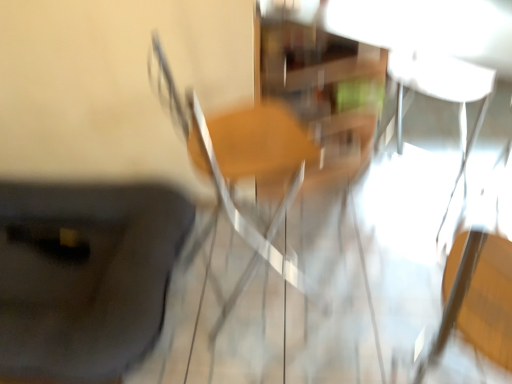
The image size is (512, 384). What do you see at coordinates (212, 177) in the screenshot?
I see `wooden chair at center` at bounding box center [212, 177].

This screenshot has width=512, height=384. I want to click on wooden chair at center, so click(x=212, y=177).

The height and width of the screenshot is (384, 512). Find the location of `black matte suitcase at lower left`. black matte suitcase at lower left is located at coordinates pos(85,276).

What do you see at coordinates (85, 276) in the screenshot? I see `black matte suitcase at lower left` at bounding box center [85, 276].

Image resolution: width=512 pixels, height=384 pixels. In order to click on wooden chair at center in this screenshot , I will do `click(212, 177)`.

Considering the relative positions of black matte suitcase at lower left and wooden chair at center in the image provided, is black matte suitcase at lower left to the left of wooden chair at center from the viewer's perspective?

Yes.

Considering their positions, is black matte suitcase at lower left located in front of or behind wooden chair at center?

Visually, black matte suitcase at lower left is located behind wooden chair at center.

Does point (143, 332) appear closer or farther from the camera than point (267, 243)?

Point (143, 332) is closer to the camera than point (267, 243).

From the image's perspective, is black matte suitcase at lower left above or below wooden chair at center?

black matte suitcase at lower left is situated lower than wooden chair at center in the image.

From a real-world perspective, is black matte suitcase at lower left below wooden chair at center?

Yes.

Considering the sizes of objects black matte suitcase at lower left and wooden chair at center in the image provided, who is wider, black matte suitcase at lower left or wooden chair at center?

black matte suitcase at lower left.

Considering the sizes of black matte suitcase at lower left and wooden chair at center in the image, is black matte suitcase at lower left taller or shorter than wooden chair at center?

Clearly, black matte suitcase at lower left is shorter compared to wooden chair at center.

Is black matte suitcase at lower left bigger or smaller than wooden chair at center?

black matte suitcase at lower left is bigger than wooden chair at center.

Choose the correct answer: Is black matte suitcase at lower left inside wooden chair at center or outside it?

black matte suitcase at lower left exists outside the volume of wooden chair at center.

Is black matte suitcase at lower left not close to wooden chair at center?

They are positioned close to each other.

Could you tell me if black matte suitcase at lower left is turned towards wooden chair at center?

No.

The width and height of the screenshot is (512, 384). I want to click on chair on the right of black matte suitcase at lower left, so click(x=212, y=177).

Can you confirm if wooden chair at center is positioned to the left of black matte suitcase at lower left?

In fact, wooden chair at center is to the right of black matte suitcase at lower left.

Which object is closer to the camera taking this photo, wooden chair at center or black matte suitcase at lower left?

wooden chair at center is in front.

Is point (180, 125) closer or farther from the camera than point (33, 241)?

Point (180, 125) appears to be closer to the viewer than point (33, 241).

From the image's perspective, is wooden chair at center on black matte suitcase at lower left?

Yes, from the image's perspective, wooden chair at center is above black matte suitcase at lower left.

Consider the image. From a real-world perspective, relative to black matte suitcase at lower left, is wooden chair at center vertically above or below?

In terms of real-world spatial position, wooden chair at center is above black matte suitcase at lower left.

Considering the sizes of objects wooden chair at center and black matte suitcase at lower left in the image provided, who is thinner, wooden chair at center or black matte suitcase at lower left?

wooden chair at center.

Is wooden chair at center taller than black matte suitcase at lower left?

Yes.

Consider the image. Who is bigger, wooden chair at center or black matte suitcase at lower left?

black matte suitcase at lower left is bigger.

Is wooden chair at center inside the boundaries of black matte suitcase at lower left, or outside?

wooden chair at center lies outside black matte suitcase at lower left.

Is wooden chair at center with black matte suitcase at lower left?

wooden chair at center and black matte suitcase at lower left are clearly separated.

Could you tell me if wooden chair at center is turned towards black matte suitcase at lower left?

No, wooden chair at center is not aimed at black matte suitcase at lower left.

How distant is wooden chair at center from black matte suitcase at lower left?

17.07 inches.

At what (x,y) coordinates should I click in order to perform the action: click on furniture behind the wooden chair at center. Please return your answer as a coordinate pair (x, y). This screenshot has height=384, width=512. Looking at the image, I should click on (85, 276).

Where is `chair above the black matte suitcase at lower left (from a real-world perspective)`? The width and height of the screenshot is (512, 384). chair above the black matte suitcase at lower left (from a real-world perspective) is located at coordinates (212, 177).

Locate an element on the screen. The width and height of the screenshot is (512, 384). furniture that is on the left side of wooden chair at center is located at coordinates (85, 276).